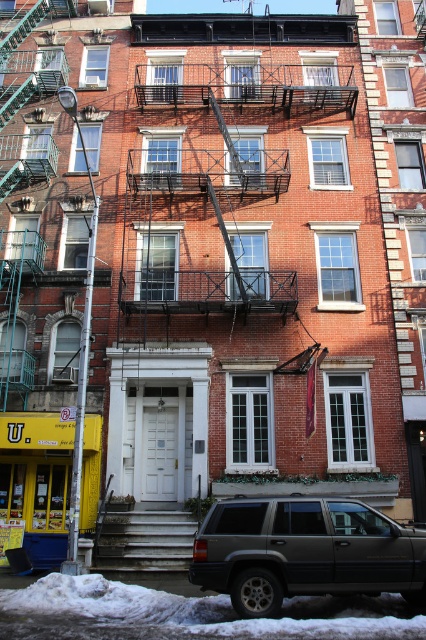
Question: Does dark gray matte suv at lower right appear on the left side of white painted wood stairs at center?

Choices:
 (A) yes
 (B) no

Answer: (B)

Question: Can you confirm if dark gray matte suv at lower right is positioned to the right of white painted wood stairs at center?

Choices:
 (A) no
 (B) yes

Answer: (B)

Question: In this image, where is dark gray matte suv at lower right located relative to white painted wood stairs at center?

Choices:
 (A) above
 (B) below

Answer: (A)

Question: Which of the following is the farthest from the observer?

Choices:
 (A) (249, 608)
 (B) (100, 552)

Answer: (B)